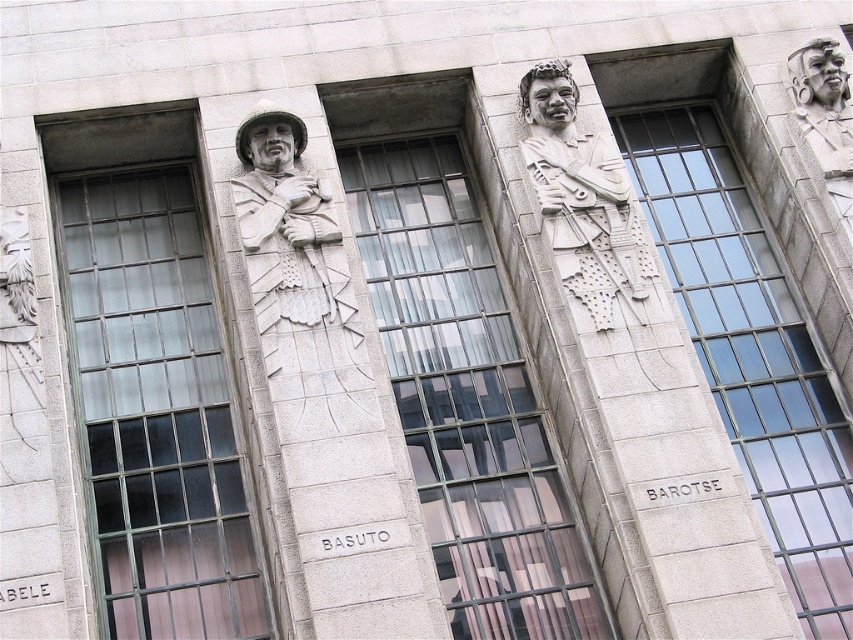
Question: Does clear glass window at left have a larger size compared to clear glass window at center?

Choices:
 (A) yes
 (B) no

Answer: (B)

Question: Which of the following is the closest to the observer?

Choices:
 (A) white stone figure at center
 (B) clear glass window at center
 (C) clear glass window at left
 (D) clear glass window at center right

Answer: (B)

Question: Can you confirm if clear glass window at left is wider than clear glass window at center?

Choices:
 (A) no
 (B) yes

Answer: (B)

Question: Among these points, which one is farthest from the camera?

Choices:
 (A) (670, 253)
 (B) (532, 81)

Answer: (A)

Question: Which point is farther from the camera taking this photo?

Choices:
 (A) (793, 65)
 (B) (560, 264)
 (C) (265, 140)

Answer: (A)

Question: Where is white stone figure at center located in relation to polished stone head at upper right in the image?

Choices:
 (A) below
 (B) above

Answer: (A)